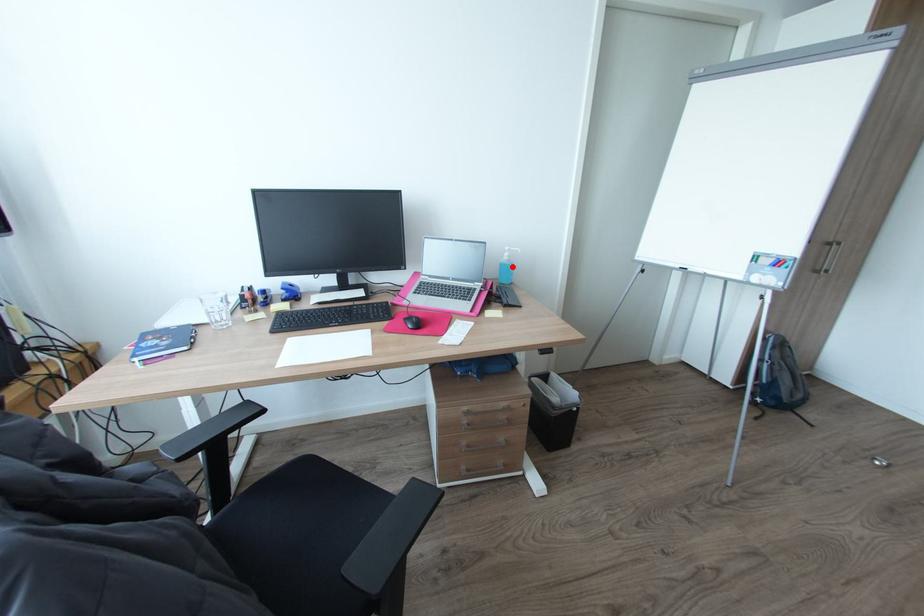
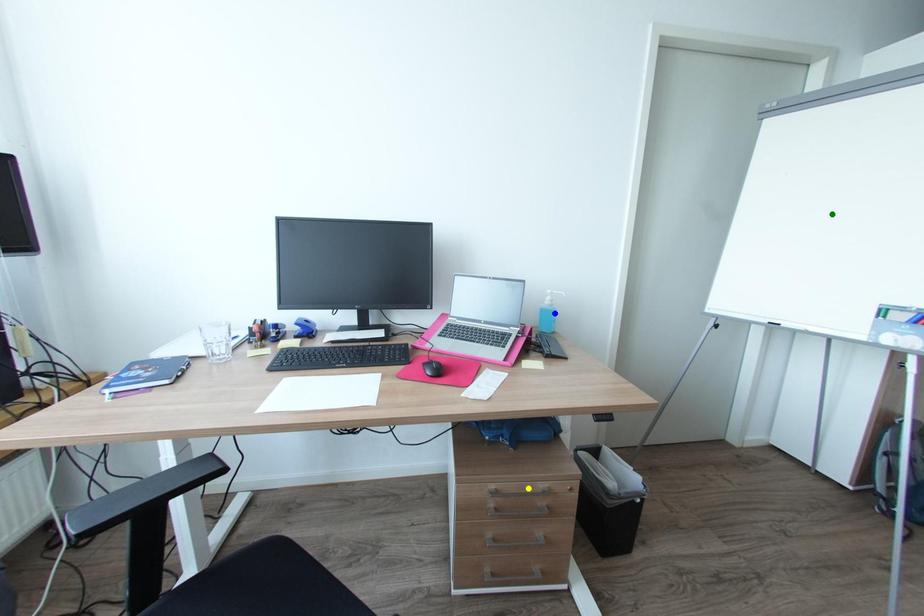
Question: I am providing you with two images of the same scene from different viewpoints. A red point is marked on the first image. You are given multiple points on the second image. Which spot in image 2 lines up with the point in image 1?

Choices:
 (A) blue point
 (B) green point
 (C) yellow point

Answer: (A)